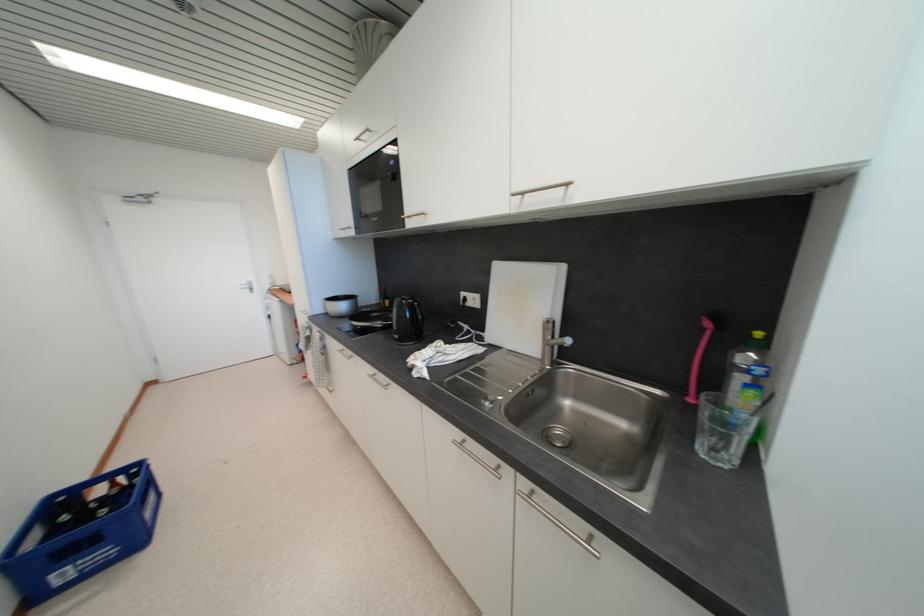
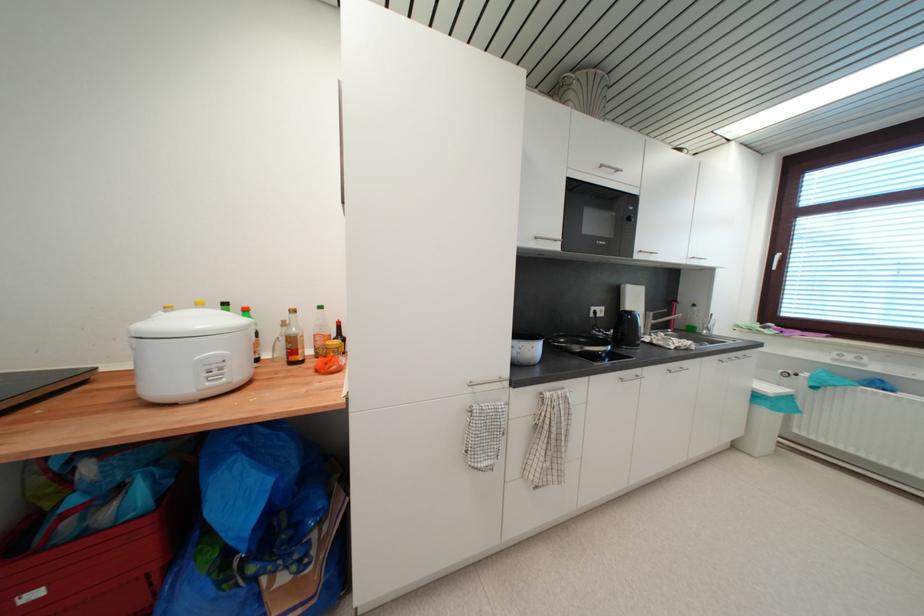
Question: I am providing you with two images of the same scene from different viewpoints. Which of the following objects are not visible in image2?

Choices:
 (A) dark glass bottle
 (B) plastic bag of nuts
 (C) white window handle
 (D) white cooking pot

Answer: (A)